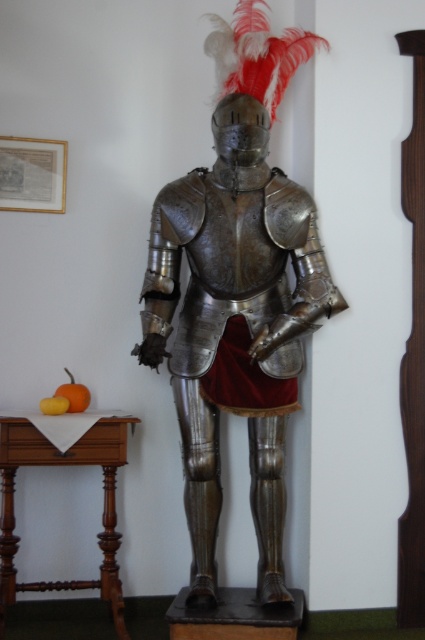
You are standing in front of the medieval armor display. There are two points marked on the armor. One is at point coordinates (286,364) and the other is at (6,577). Which point is closer to you?

Point coordinates (286,364) is further to the viewer than point coordinates (6,577). Therefore, the point at (286,364) is closer to you.

You are standing in front of the medieval armor display. There is a point marked at coordinates (237, 292). What object is located at this point?

The point at coordinates (237, 292) marks the shiny metallic armor at center.

You are an archer positioned at the corner of the room. You need to aim an arrow at the shiny metallic armor at center. Given that the armor is placed at coordinates point 0.459, 0.558, can you estimate the direction you should aim relative to your position?

The shiny metallic armor at center is located at point (237, 292), so you should aim towards that coordinate relative to your position at the corner.